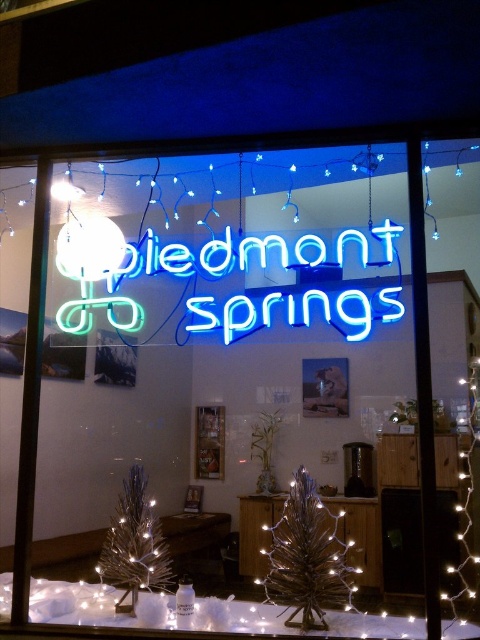
You are standing in front of the Piedmont Springs storefront and want to know if the point at location (316,248) is closer to you than the point at (139,515). Based on the scene, what can you determine?

The point at (316,248) is behind the point at (139,515), so it is farther away from you.

You are standing in front of the Piedmont Springs store and want to take a photo of the neon sign. The camera you are using has a minimum focus distance of 2 meters. Will the camera be able to focus on the point at coordinates point (348, 600)?

The point at coordinates point (348, 600) is 2.14 meters from the camera, which is beyond the minimum focus distance of 2 meters. Therefore, the camera should be able to focus on the point.